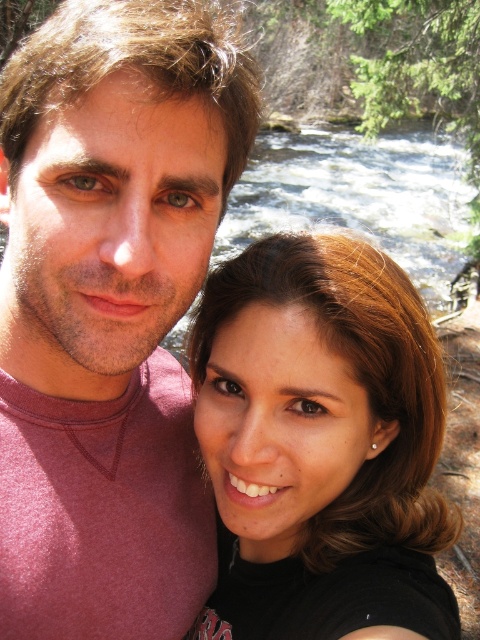
You are using a photo editing software and want to place a sticker exactly at the center of the matte pink shirt at center. What are the coordinates you should input into the software to ensure the sticker is placed correctly?

The coordinates for the center of the matte pink shirt at center are at point (109, 310), so you should input those coordinates into the software to place the sticker exactly at the center of the matte pink shirt at center.

You are taking a selfie with two people near a river. You notice a point at coordinates (109,310) in the image. Which object from the scene is located at this point?

The point at coordinates (109,310) indicates the matte pink shirt at center.